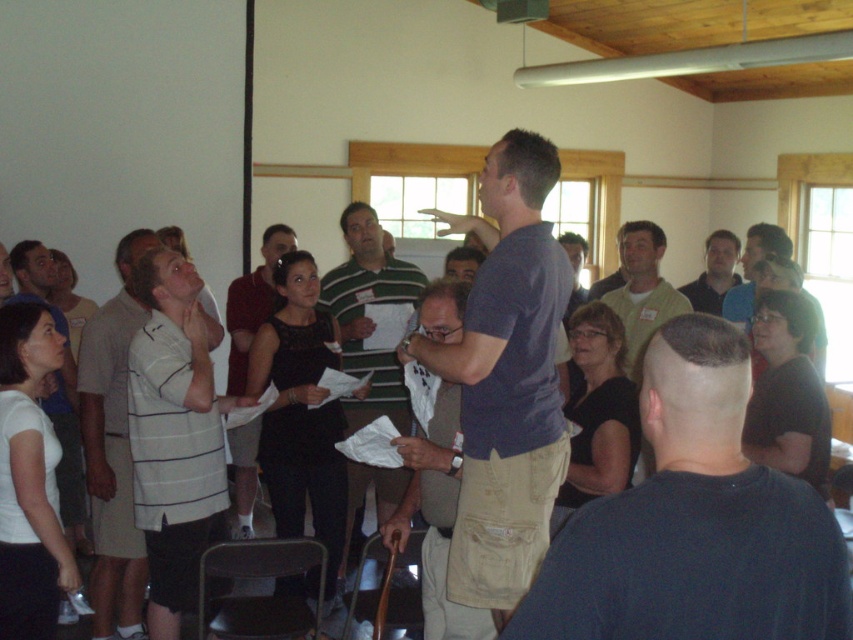
Question: Among these points, which one is nearest to the camera?

Choices:
 (A) (738, 248)
 (B) (82, 387)

Answer: (B)

Question: Among these points, which one is farthest from the camera?

Choices:
 (A) (706, 524)
 (B) (386, 364)
 (C) (281, 244)

Answer: (C)

Question: Is matte blue shirt at center further to camera compared to white striped polo shirt at left?

Choices:
 (A) yes
 (B) no

Answer: (B)

Question: Among these points, which one is farthest from the camera?

Choices:
 (A) (552, 611)
 (B) (434, 412)
 (C) (463, 328)

Answer: (B)

Question: Can you confirm if matte blue shirt at center is positioned to the right of matte green shirt at center?

Choices:
 (A) no
 (B) yes

Answer: (A)

Question: Considering the relative positions of white striped polo shirt at left and green striped shirt at center in the image provided, where is white striped polo shirt at left located with respect to green striped shirt at center?

Choices:
 (A) right
 (B) left

Answer: (B)